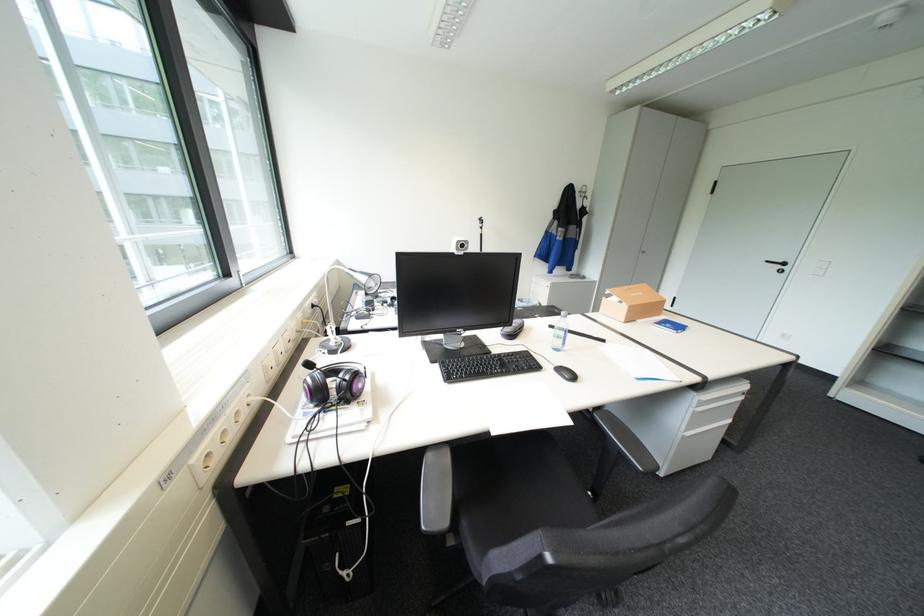
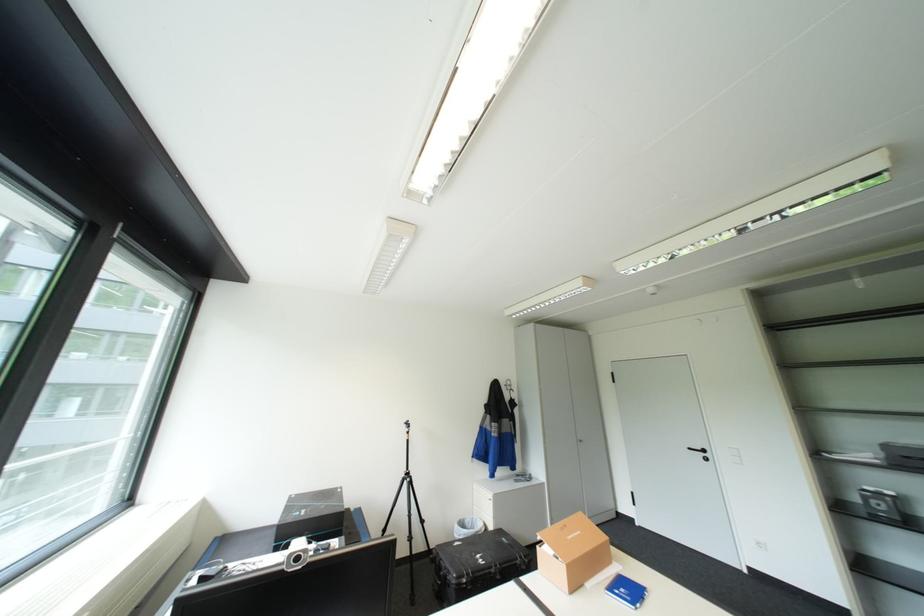
The point at (531, 299) is marked in the first image. Where is the corresponding point in the second image?

(475, 521)